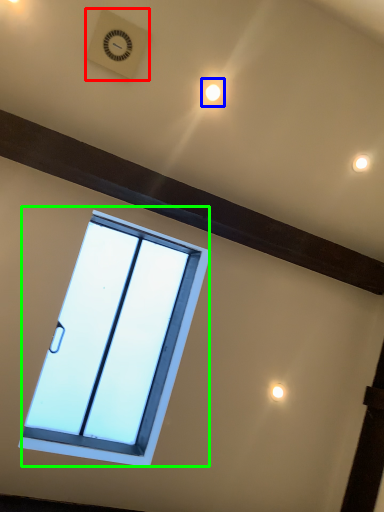
Question: Which object is positioned closest to clock (highlighted by a red box)? Select from light (highlighted by a blue box) and window (highlighted by a green box).

Choices:
 (A) light
 (B) window

Answer: (A)